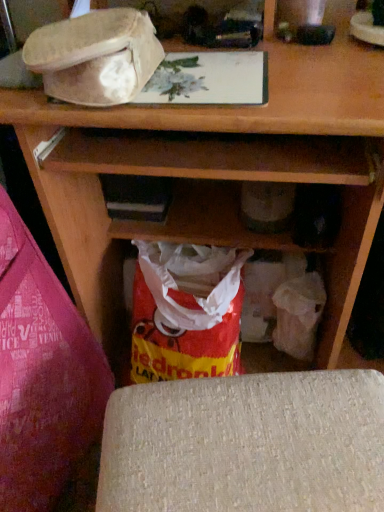
Question: Looking at their shapes, would you say fuzzy beige hat at upper left is wider or thinner than red plastic grocery bag at lower center?

Choices:
 (A) wide
 (B) thin

Answer: (B)

Question: Is fuzzy beige hat at upper left inside the boundaries of red plastic grocery bag at lower center, or outside?

Choices:
 (A) outside
 (B) inside

Answer: (A)

Question: Based on their relative distances, which object is nearer to the red plastic grocery bag at lower center?

Choices:
 (A) fuzzy beige hat at upper left
 (B) textured beige cushion at lower center
 (C) red plastic bag at lower left

Answer: (C)

Question: Based on their relative distances, which object is farther from the red plastic bag at lower left?

Choices:
 (A) red plastic grocery bag at lower center
 (B) fuzzy beige hat at upper left
 (C) textured beige cushion at lower center

Answer: (B)